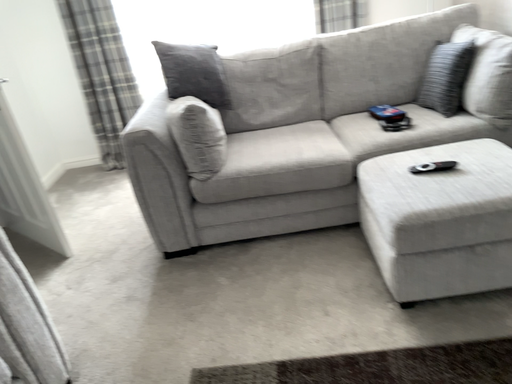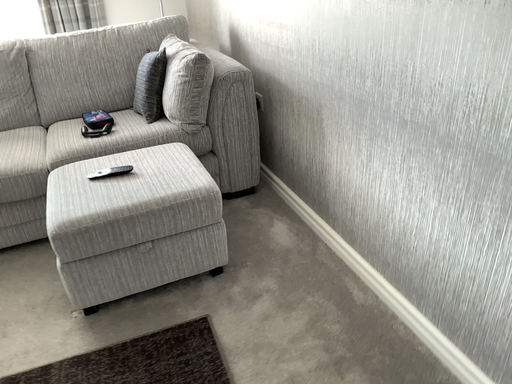
Question: How did the camera likely rotate when shooting the video?

Choices:
 (A) rotated right
 (B) rotated left

Answer: (A)